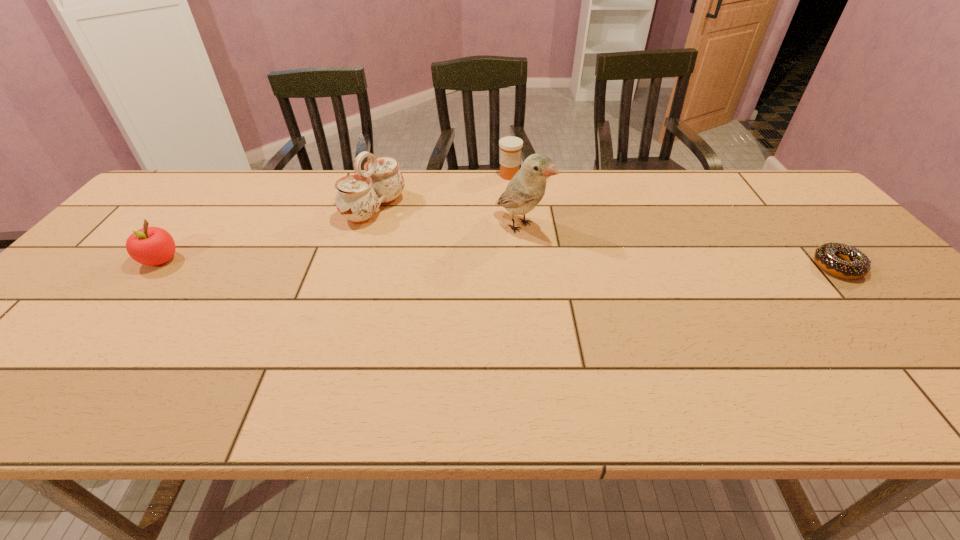
At what (x,y) coordinates should I click in order to perform the action: click on medicine that is at the far edge. Please return your answer as a coordinate pair (x, y). This screenshot has width=960, height=540. Looking at the image, I should click on (510, 147).

The image size is (960, 540). I want to click on object present at the left edge, so click(x=151, y=246).

At what (x,y) coordinates should I click in order to perform the action: click on object located in the right edge section of the desktop. Please return your answer as a coordinate pair (x, y). The height and width of the screenshot is (540, 960). Looking at the image, I should click on (840, 260).

Identify the location of vacant space at the far edge of the desktop. (273, 169).

You are a GUI agent. You are given a task and a screenshot of the screen. Output one action in this format:
    pyautogui.click(x=<x>, y=<y>)
    Task: Click on the vacant space at the near edge of the desktop
    This screenshot has height=540, width=960.
    Given the screenshot: What is the action you would take?
    pyautogui.click(x=328, y=354)

The height and width of the screenshot is (540, 960). Find the location of `vacant space at the left edge of the desktop`. vacant space at the left edge of the desktop is located at coordinates (100, 276).

Image resolution: width=960 pixels, height=540 pixels. In the image, there is a desktop. Find the location of `vacant space at the right edge`. vacant space at the right edge is located at coordinates (864, 297).

In the image, there is a desktop. Where is `vacant area at the near left corner`? vacant area at the near left corner is located at coordinates (70, 338).

Image resolution: width=960 pixels, height=540 pixels. In the image, there is a desktop. Find the location of `free space at the far right corner`. free space at the far right corner is located at coordinates (761, 190).

Locate an element on the screen. free space between the second object from left to right and the medicine is located at coordinates (442, 192).